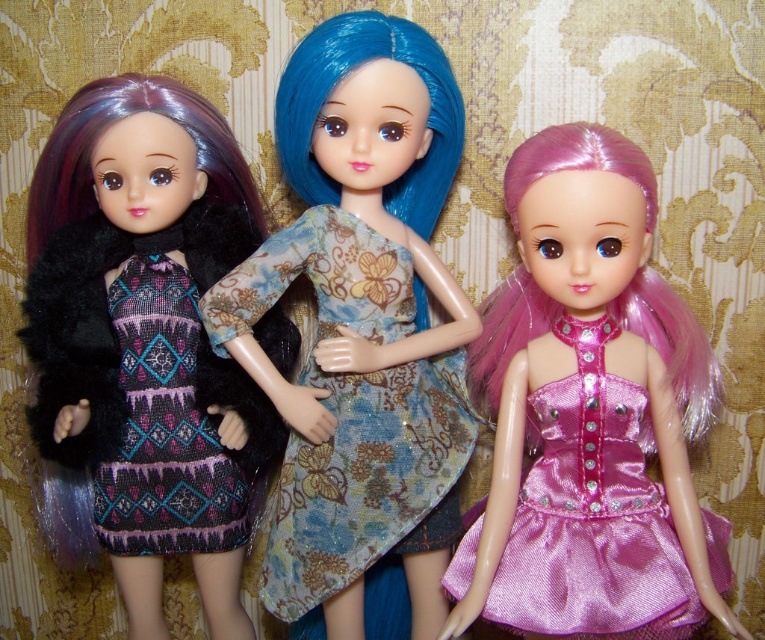
Does shiny floral dress at center appear under patterned fabric dress at left?

No.

Which is more to the right, shiny floral dress at center or patterned fabric dress at left?

Positioned to the right is shiny floral dress at center.

The height and width of the screenshot is (640, 765). Find the location of `shiny floral dress at center`. shiny floral dress at center is located at coordinates (360, 324).

Which of these two, shiny black fur coat at left or shiny pink satin dress at right, stands taller?

Standing taller between the two is shiny black fur coat at left.

Between point (73, 157) and point (532, 518), which one is positioned behind?

Positioned behind is point (73, 157).

Between point (287, 352) and point (597, 355), which one is positioned in front?

Point (597, 355)

Image resolution: width=765 pixels, height=640 pixels. I want to click on shiny black fur coat at left, so click(x=145, y=342).

Is shiny black fur coat at left thinner than patterned fabric dress at left?

Incorrect, shiny black fur coat at left's width is not less than patterned fabric dress at left's.

Is shiny black fur coat at left smaller than patterned fabric dress at left?

Incorrect, shiny black fur coat at left is not smaller in size than patterned fabric dress at left.

Between point (243, 176) and point (148, 429), which one is positioned behind?

Positioned behind is point (243, 176).

What are the coordinates of `shiny black fur coat at left` in the screenshot? It's located at (145, 342).